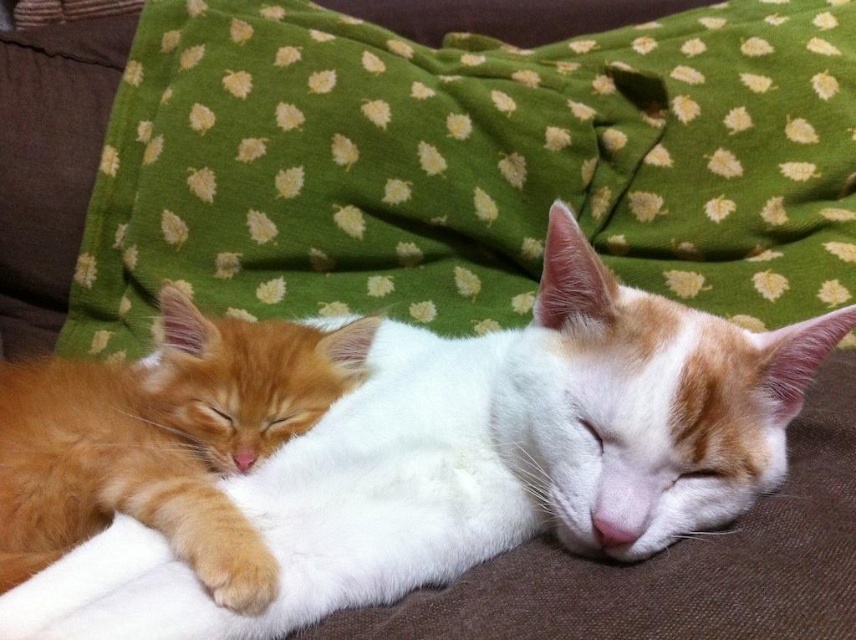
Question: Which of the following is the closest to the observer?

Choices:
 (A) (46, 572)
 (B) (214, 326)

Answer: (A)

Question: Which point is closer to the camera?

Choices:
 (A) fluffy orange cat at center
 (B) white soft fur cat at center

Answer: (B)

Question: Is white soft fur cat at center positioned behind fluffy orange cat at center?

Choices:
 (A) yes
 (B) no

Answer: (B)

Question: Is white soft fur cat at center bigger than fluffy orange cat at center?

Choices:
 (A) yes
 (B) no

Answer: (A)

Question: Does white soft fur cat at center have a lesser width compared to fluffy orange cat at center?

Choices:
 (A) yes
 (B) no

Answer: (B)